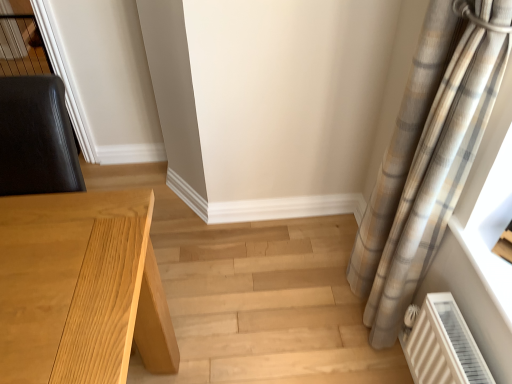
Locate an element on the screen. free point behind plaid fabric curtain at right is located at coordinates (327, 258).